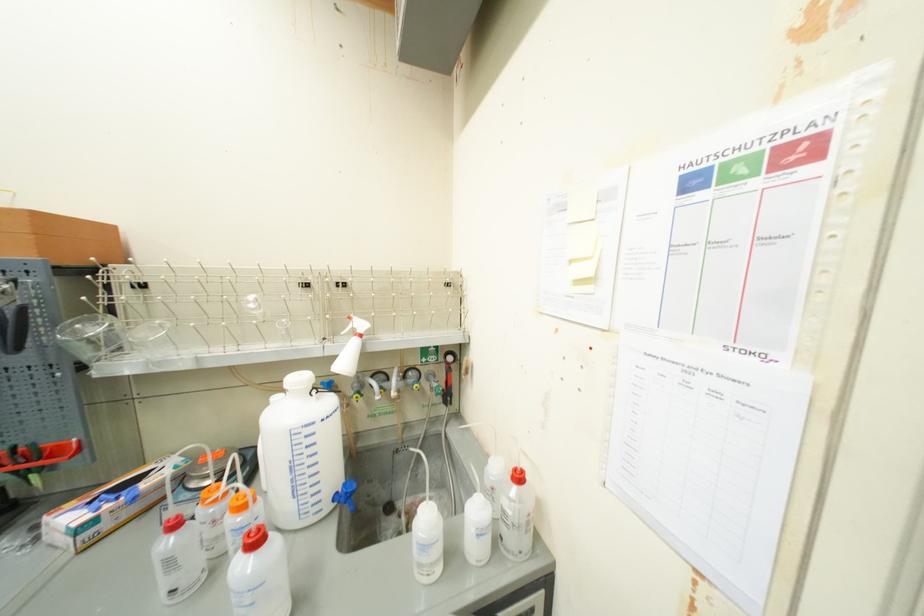
Which object does [300,453] point to?

It corresponds to the glass flask in the image.